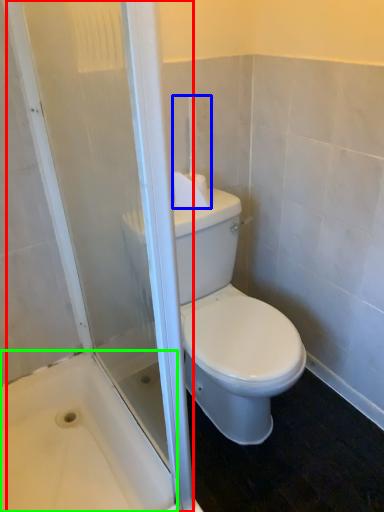
Question: Based on their relative distances, which object is nearer to screen door (highlighted by a red box)? Choose from towel bar (highlighted by a blue box) and bath (highlighted by a green box).

Choices:
 (A) towel bar
 (B) bath

Answer: (B)